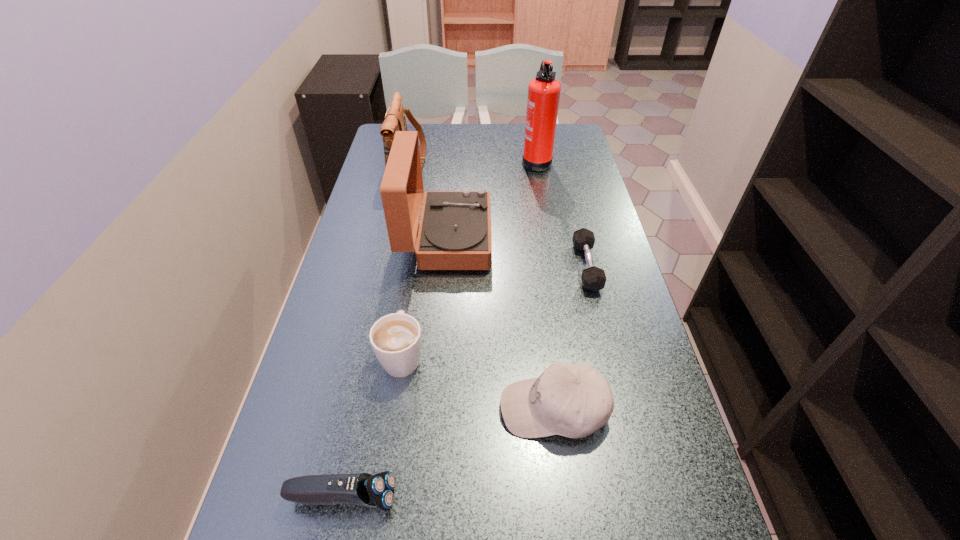
You are a GUI agent. You are given a task and a screenshot of the screen. Output one action in this format:
    pyautogui.click(x=<x>, y=<y>)
    Task: Click on the vacant space that satisfies the following two spatial constraints: 1. at the nozzle of the fire extinguisher; 2. on the left side of the dumbbell
    This screenshot has width=960, height=540.
    Given the screenshot: What is the action you would take?
    pyautogui.click(x=555, y=266)